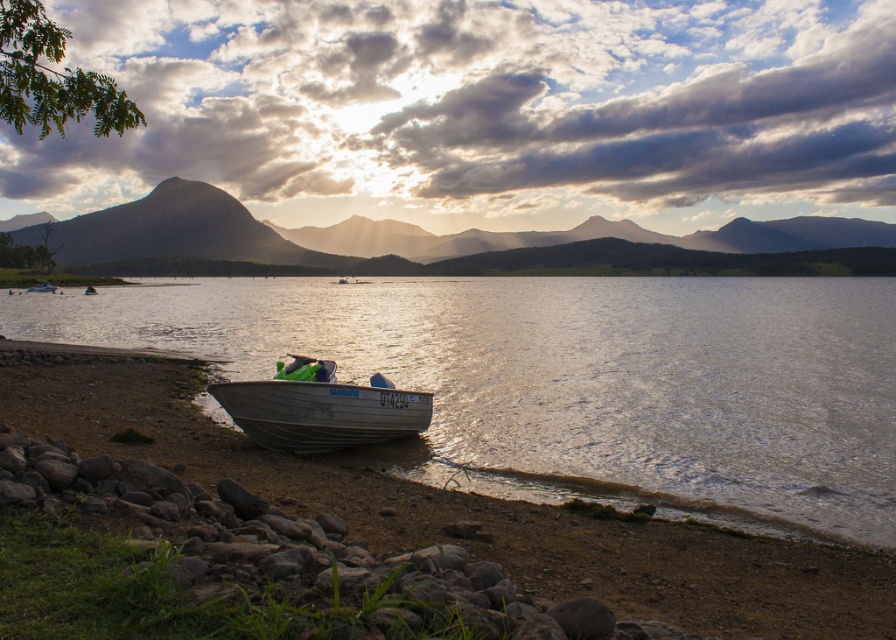
Question: Among these objects, which one is nearest to the camera?

Choices:
 (A) clear water at boat left
 (B) silver metallic boat at lower center

Answer: (A)

Question: Can you confirm if matte gray mountain at center is bigger than silver metallic boat at lower center?

Choices:
 (A) yes
 (B) no

Answer: (A)

Question: Is clear water at boat left to the right of matte gray mountain at center from the viewer's perspective?

Choices:
 (A) yes
 (B) no

Answer: (B)

Question: Which of the following is the closest to the observer?

Choices:
 (A) silver metallic boat at lower center
 (B) matte gray mountain at center

Answer: (A)

Question: Based on their relative distances, which object is farther from the matte gray mountain at center?

Choices:
 (A) silver metallic boat at lower center
 (B) clear water at boat left

Answer: (A)

Question: Can you confirm if matte gray mountain at center is positioned above silver metallic boat at lower center?

Choices:
 (A) no
 (B) yes

Answer: (B)